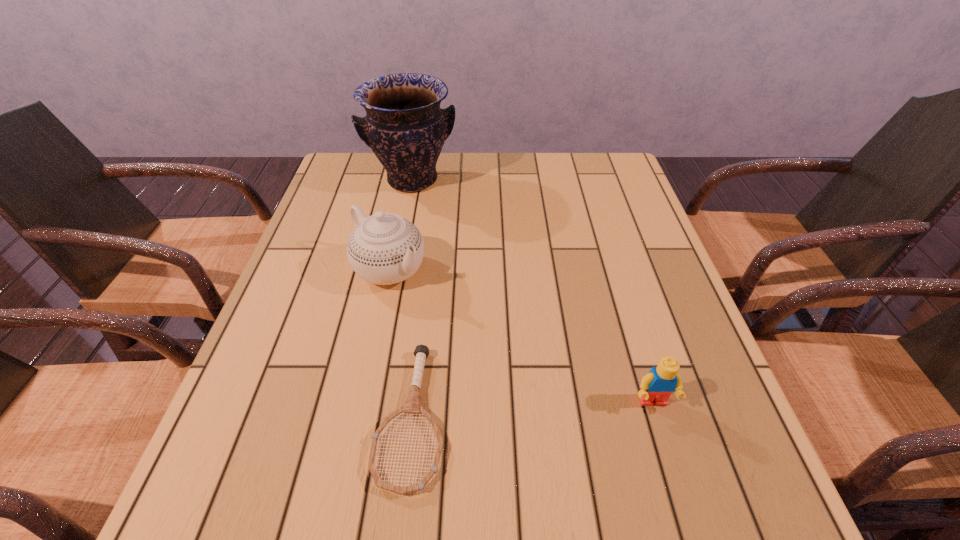
At what (x,y) coordinates should I click in order to perform the action: click on vacant space on the desktop that is between the tennis racket and the rightmost object and is positioned on the front handle of the pottery. Please return your answer as a coordinate pair (x, y). Looking at the image, I should click on (508, 411).

Where is `free space on the desktop that is between the tennis racket and the Lego and is positioned on the spout of the third nearest object`? The image size is (960, 540). free space on the desktop that is between the tennis racket and the Lego and is positioned on the spout of the third nearest object is located at coordinates (561, 408).